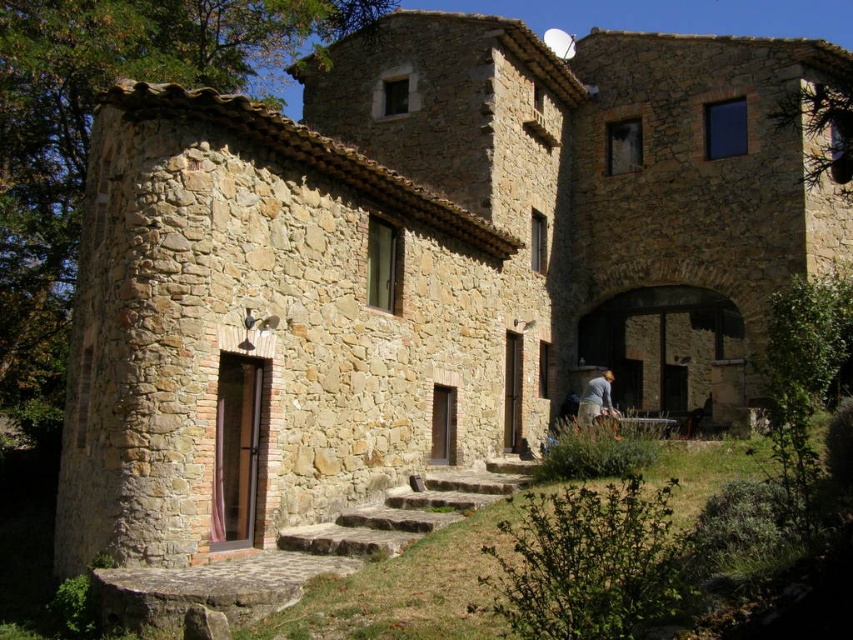
Question: Is natural stone stairs at lower center positioned before natural stone stairs at center?

Choices:
 (A) yes
 (B) no

Answer: (A)

Question: Which object appears closest to the camera in this image?

Choices:
 (A) natural stone stairs at lower center
 (B) gray fabric shirt at lower right

Answer: (A)

Question: Is natural stone stairs at lower center smaller than natural stone stairs at center?

Choices:
 (A) no
 (B) yes

Answer: (A)

Question: Which point is closer to the camera?

Choices:
 (A) (593, 387)
 (B) (405, 540)

Answer: (B)

Question: Which point is closer to the camera?

Choices:
 (A) natural stone stairs at center
 (B) natural stone stairs at lower center

Answer: (B)

Question: Is the position of natural stone stairs at center more distant than that of gray fabric shirt at lower right?

Choices:
 (A) yes
 (B) no

Answer: (B)